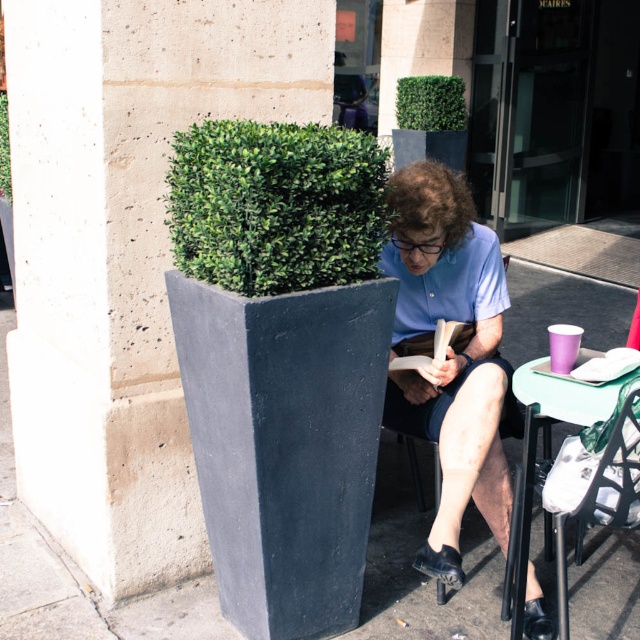
Question: Among these objects, which one is farthest from the camera?

Choices:
 (A) green leafy hedge at upper left
 (B) green textured hedge at upper center
 (C) green textured hedge at upper left
 (D) light blue shirt at center

Answer: (B)

Question: Can you confirm if light blue shirt at center is positioned to the right of green leafy hedge at upper left?

Choices:
 (A) yes
 (B) no

Answer: (A)

Question: Is green textured hedge at upper center to the left of green textured hedge at upper left from the viewer's perspective?

Choices:
 (A) no
 (B) yes

Answer: (A)

Question: Can you confirm if green textured hedge at upper center is wider than green textured hedge at upper left?

Choices:
 (A) yes
 (B) no

Answer: (A)

Question: Which of these objects is positioned closest to the green textured hedge at upper left?

Choices:
 (A) smooth concrete planter at left
 (B) light blue shirt at center
 (C) green leafy hedge at upper left
 (D) green textured hedge at upper center

Answer: (A)

Question: Which object appears closest to the camera in this image?

Choices:
 (A) green leafy hedge at upper left
 (B) light blue shirt at center

Answer: (A)